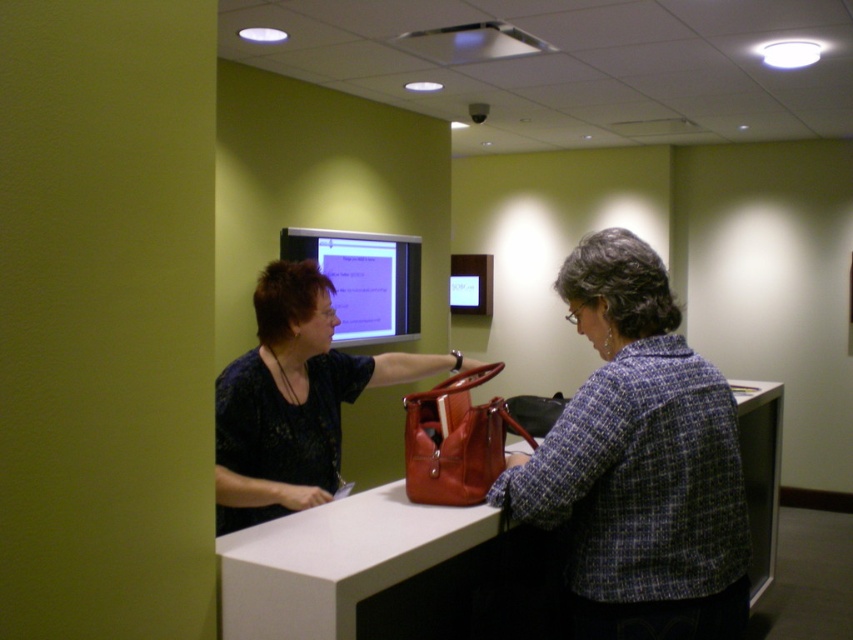
Is plaid wool jacket at center bigger than matte plastic monitor at center?

Actually, plaid wool jacket at center might be smaller than matte plastic monitor at center.

Is point (664, 282) positioned in front of point (347, 332)?

Yes.

You are a GUI agent. You are given a task and a screenshot of the screen. Output one action in this format:
    pyautogui.click(x=<x>, y=<y>)
    Task: Click on the plaid wool jacket at center
    The image size is (853, 640).
    Given the screenshot: What is the action you would take?
    pyautogui.click(x=637, y=461)

Is leather handbag at center further to camera compared to matte plastic monitor at center?

No, leather handbag at center is in front of matte plastic monitor at center.

Which is behind, point (415, 557) or point (311, 244)?

The point (311, 244) is more distant.

The image size is (853, 640). Identify the location of leather handbag at center. (387, 573).

At what (x,y) coordinates should I click in order to perform the action: click on leather handbag at center. Please return your answer as a coordinate pair (x, y). This screenshot has width=853, height=640. Looking at the image, I should click on pyautogui.click(x=387, y=573).

Based on the photo, measure the distance between leather handbag at center and camera.

leather handbag at center is 10.12 feet from camera.

Is leather handbag at center to the left of matte black blouse at center from the viewer's perspective?

In fact, leather handbag at center is to the right of matte black blouse at center.

This screenshot has height=640, width=853. What do you see at coordinates (387, 573) in the screenshot?
I see `leather handbag at center` at bounding box center [387, 573].

This screenshot has height=640, width=853. I want to click on leather handbag at center, so click(x=387, y=573).